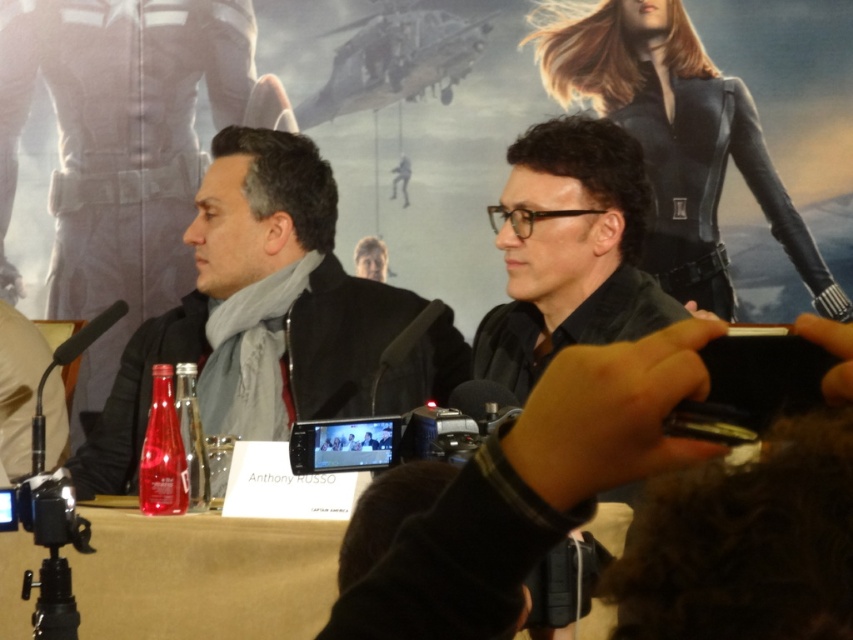
Which is behind, point (372, 310) or point (112, 320)?

The point (372, 310) is behind.

Can you confirm if black matte scarf at left is positioned to the right of black matte microphone at left?

Indeed, black matte scarf at left is positioned on the right side of black matte microphone at left.

Where is `black matte scarf at left`? black matte scarf at left is located at coordinates (274, 316).